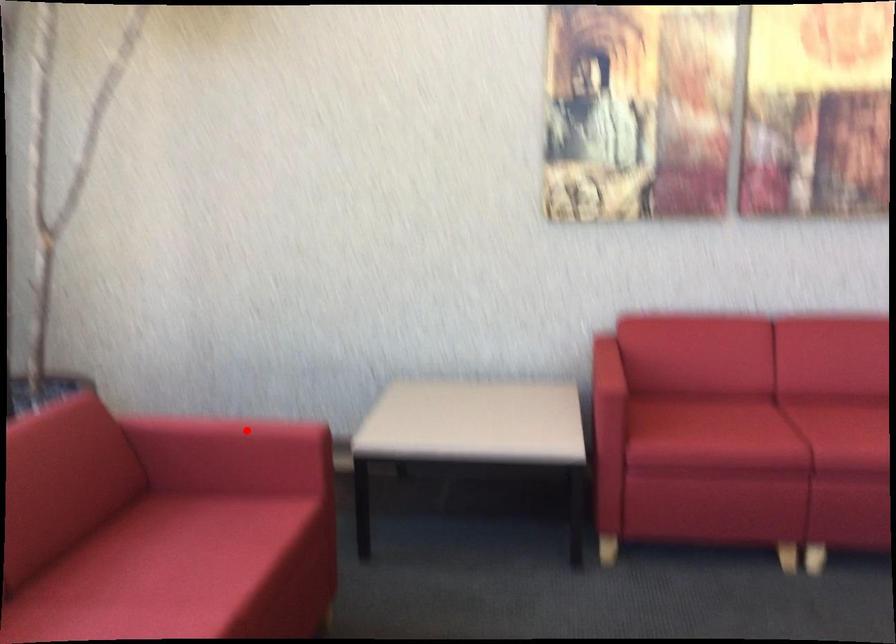
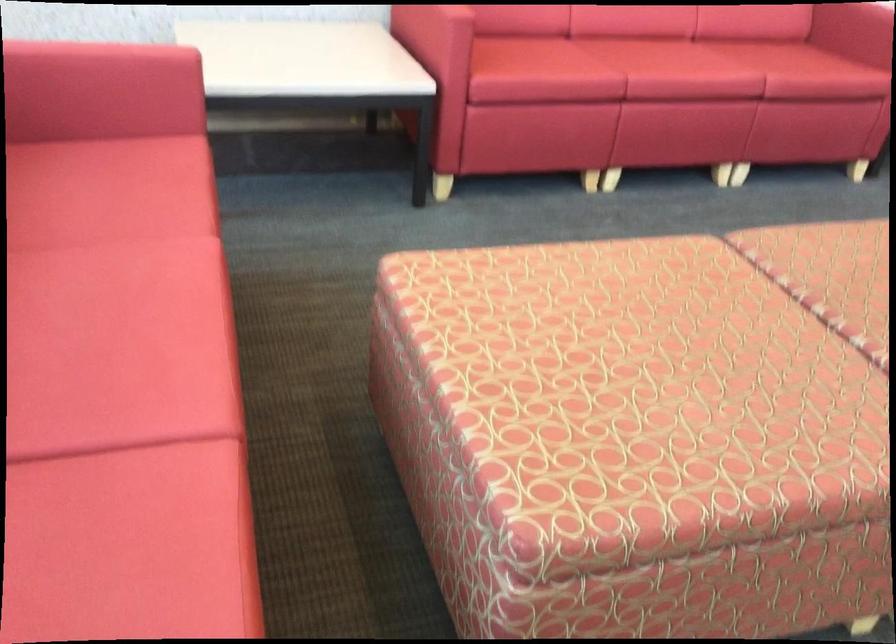
Find the pixel in the second image that matches the highlighted location in the first image.

(102, 53)